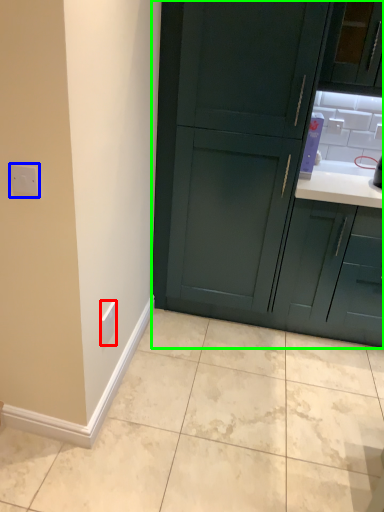
Question: Considering the real-world distances, which object is closest to electric outlet (highlighted by a red box)? electric outlet (highlighted by a blue box) or cabinetry (highlighted by a green box).

Choices:
 (A) electric outlet
 (B) cabinetry

Answer: (A)